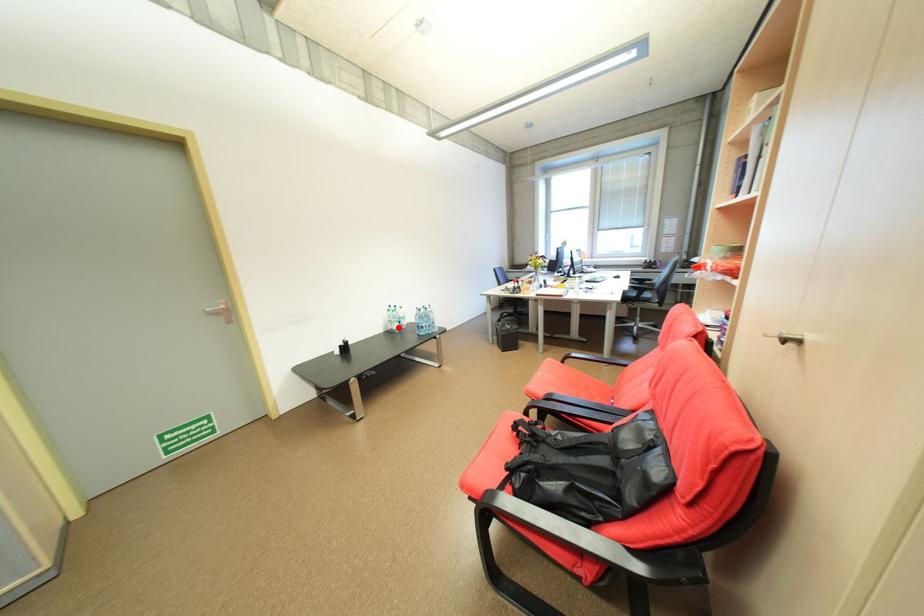
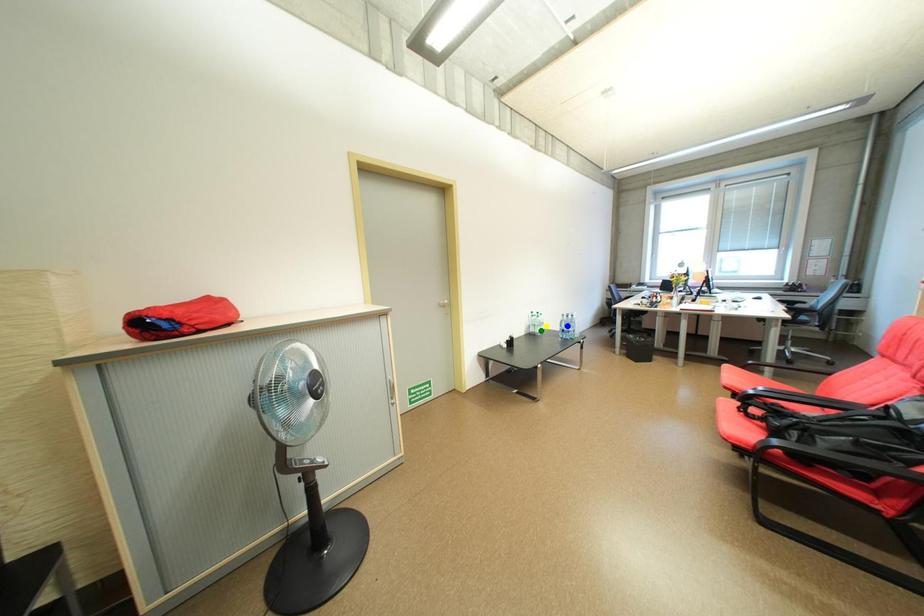
Question: I am providing you with two images of the same scene from different viewpoints. A red point is marked on the first image. You are given multiple points on the second image. Can you choose the point in image 2 that corresponds to the point in image 1?

Choices:
 (A) green point
 (B) yellow point
 (C) blue point

Answer: (A)